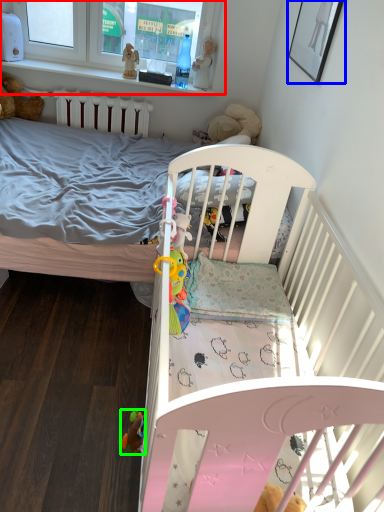
Question: Which is farther away from window frame (highlighted by a red box)? picture frame (highlighted by a blue box) or toy (highlighted by a green box)?

Choices:
 (A) picture frame
 (B) toy

Answer: (B)